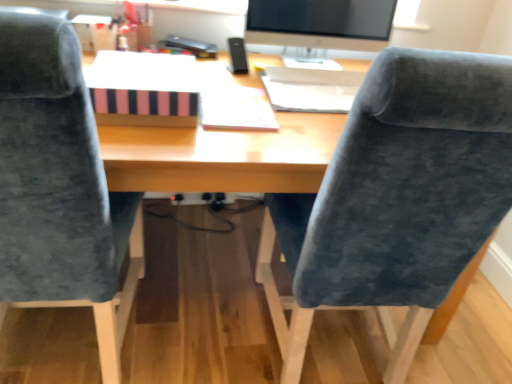
Where is `vacant space behind black plastic remote at center`? vacant space behind black plastic remote at center is located at coordinates (237, 59).